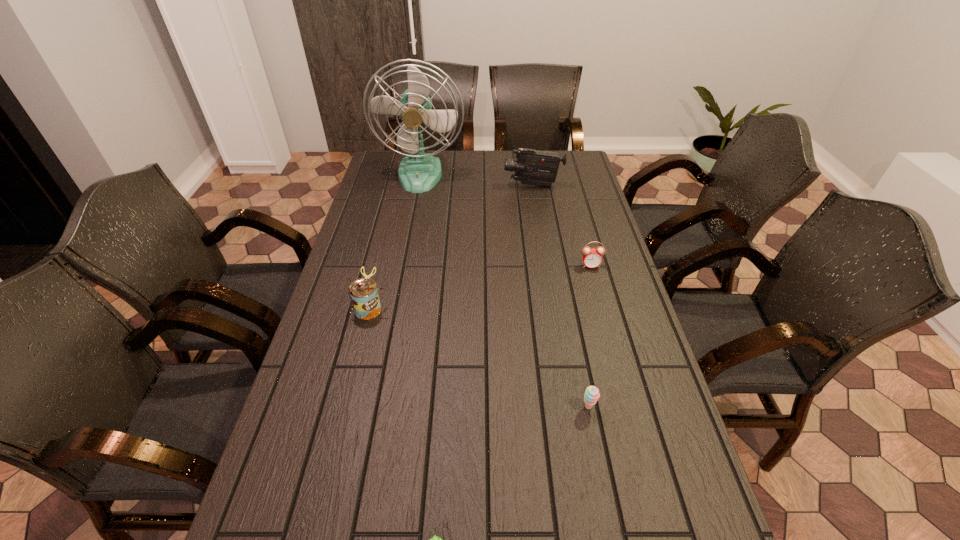
The image size is (960, 540). Identify the location of free space at the right edge of the desktop. (598, 218).

I want to click on free space between the fifth farthest object and the fan, so click(x=505, y=291).

Locate an element on the screen. The image size is (960, 540). vacant area that lies between the camcorder and the fan is located at coordinates (477, 180).

The height and width of the screenshot is (540, 960). I want to click on empty location between the tallest object and the alarm clock, so click(506, 220).

You are a GUI agent. You are given a task and a screenshot of the screen. Output one action in this format:
    pyautogui.click(x=<x>, y=<y>)
    Task: Click on the free space between the second nearest object and the can
    Image resolution: width=960 pixels, height=540 pixels.
    Given the screenshot: What is the action you would take?
    pyautogui.click(x=479, y=359)

You are a GUI agent. You are given a task and a screenshot of the screen. Output one action in this format:
    pyautogui.click(x=<x>, y=<y>)
    Task: Click on the free point between the third nearest object and the fan
    Image resolution: width=960 pixels, height=540 pixels.
    Given the screenshot: What is the action you would take?
    pyautogui.click(x=396, y=242)

I want to click on free space between the sherbert and the alarm clock, so click(589, 336).

Identify which object is the fourth nearest to the nearest object. Please provide its 2D coordinates. Your answer should be formatted as a tuple, i.e. [(x, y)], where the tuple contains the x and y coordinates of a point satisfying the conditions above.

[(419, 172)]

Identify which object is located as the fifth nearest to the third nearest object. Please provide its 2D coordinates. Your answer should be formatted as a tuple, i.e. [(x, y)], where the tuple contains the x and y coordinates of a point satisfying the conditions above.

[(532, 167)]

Find the location of a particular element. The width and height of the screenshot is (960, 540). free space that satisfies the following two spatial constraints: 1. on the front-facing side of the camcorder; 2. on the right side of the second nearest object is located at coordinates (569, 407).